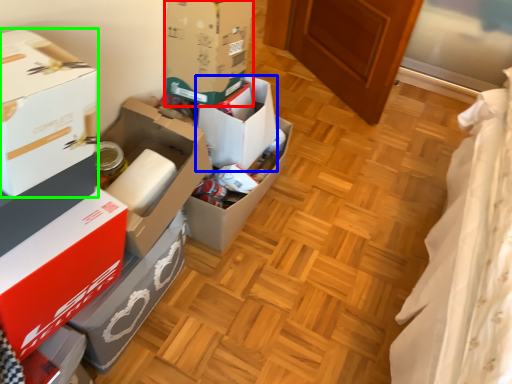
Question: Estimate the real-world distances between objects in this image. Which object is closer to box (highlighted by a red box), box (highlighted by a blue box) or box (highlighted by a green box)?

Choices:
 (A) box
 (B) box

Answer: (A)